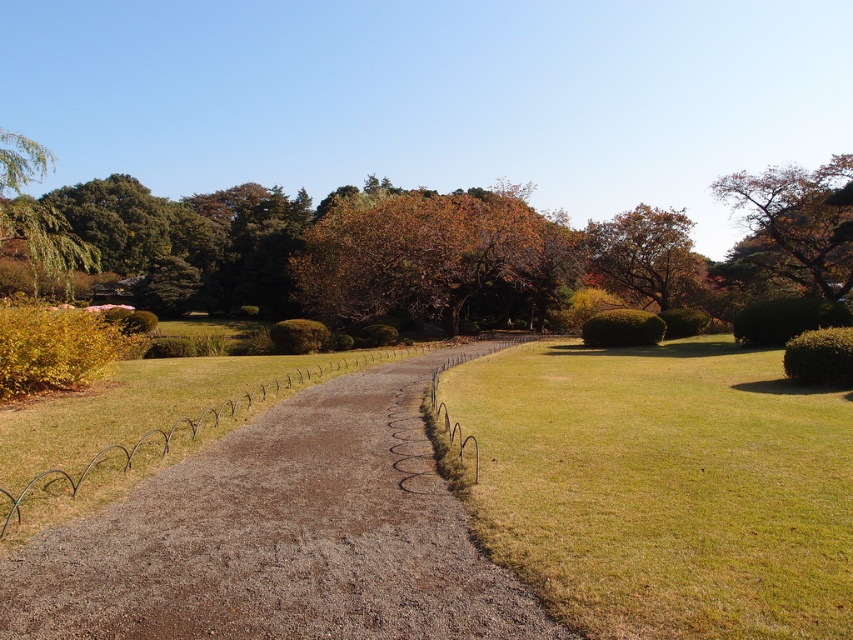
Question: Is green leafy bush at right below green leafy bush at center-right?

Choices:
 (A) no
 (B) yes

Answer: (B)

Question: Which is farther from the autumn leaves at upper right?

Choices:
 (A) green leafy tree at upper left
 (B) green leafy bush at right
 (C) green grass at center
 (D) green leafy bush at center-right

Answer: (A)

Question: Which point is closer to the camera?

Choices:
 (A) brown gravel path at center
 (B) brown leafy tree at center
 (C) green leafy bush at right
 (D) green textured bush at center

Answer: (A)

Question: Which point is closer to the camera taking this photo?

Choices:
 (A) (674, 310)
 (B) (325, 262)
 (C) (316, 342)
 (D) (71, 275)

Answer: (C)

Question: Does green leafy tree at upper left appear on the right side of green leafy bush at center?

Choices:
 (A) yes
 (B) no

Answer: (B)

Question: Can you confirm if green leafy hedge at right is bigger than green leafy bush at center-right?

Choices:
 (A) yes
 (B) no

Answer: (B)